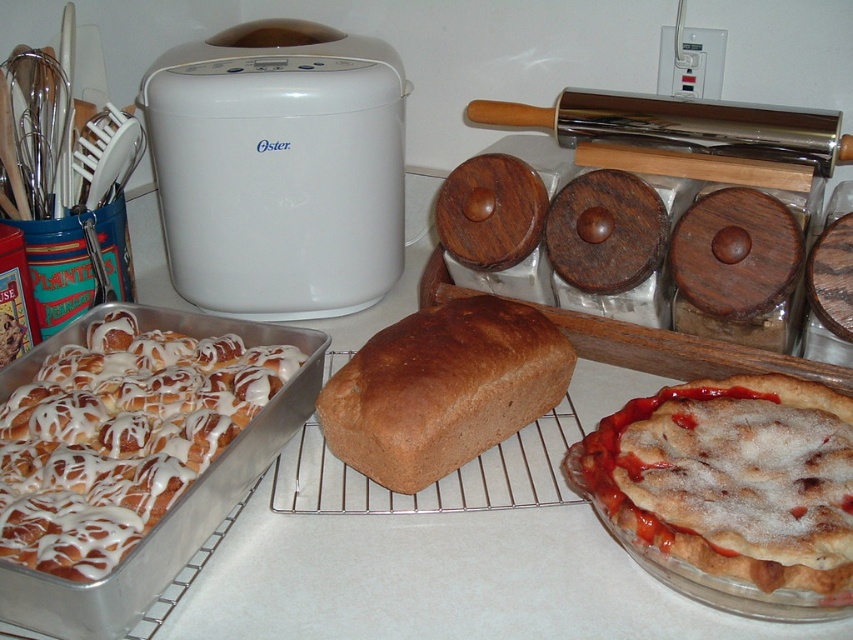
You are standing in the kitchen and want to reach the point at coordinates point (190, 54). If your arm can extend 30 inches, will you be able to reach it?

The point (190, 54) is 33.25 inches away from the camera, which is beyond your arm reach of 30 inches. Therefore, you cannot reach it.